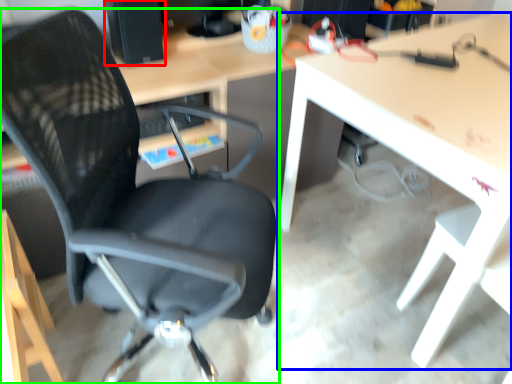
Question: Considering the real-world distances, which object is farthest from desktop computer (highlighted by a red box)? table (highlighted by a blue box) or chair (highlighted by a green box)?

Choices:
 (A) table
 (B) chair

Answer: (A)